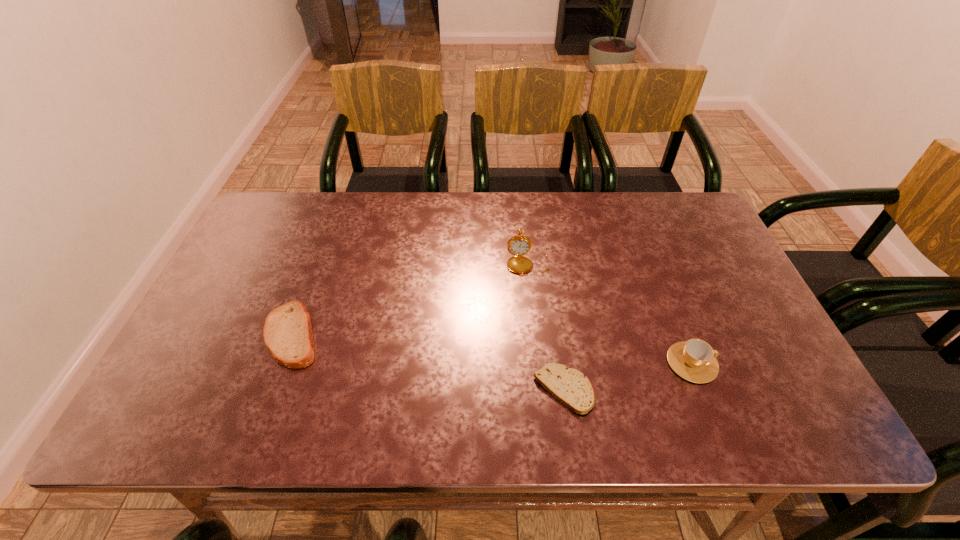
Identify the location of vacant space at the near right corner of the desktop. (795, 410).

At what (x,y) coordinates should I click in order to perform the action: click on free space between the leftmost object and the farthest object. Please return your answer as a coordinate pair (x, y). Looking at the image, I should click on (410, 299).

Where is `vacant area between the tallest object and the shorter pita bread`? The image size is (960, 540). vacant area between the tallest object and the shorter pita bread is located at coordinates (545, 326).

The width and height of the screenshot is (960, 540). In order to click on free space between the tallest object and the rightmost object in this screenshot , I will do `click(610, 313)`.

You are a GUI agent. You are given a task and a screenshot of the screen. Output one action in this format:
    pyautogui.click(x=<x>, y=<y>)
    Task: Click on the empty space that is in between the farthest object and the second tallest object
    
    Given the screenshot: What is the action you would take?
    (610, 313)

At what (x,y) coordinates should I click in order to perform the action: click on free point between the taller pita bread and the cup. Please return your answer as a coordinate pair (x, y). This screenshot has width=960, height=540. Looking at the image, I should click on (492, 349).

The image size is (960, 540). I want to click on unoccupied area between the shorter pita bread and the third shortest object, so click(628, 376).

You are a GUI agent. You are given a task and a screenshot of the screen. Output one action in this format:
    pyautogui.click(x=<x>, y=<y>)
    Task: Click on the unoccupied area between the left pita bread and the third shortest object
    
    Given the screenshot: What is the action you would take?
    pyautogui.click(x=492, y=349)

The image size is (960, 540). Identify the location of vacant area between the farthest object and the shorter pita bread. (545, 326).

You are a GUI agent. You are given a task and a screenshot of the screen. Output one action in this format:
    pyautogui.click(x=<x>, y=<y>)
    Task: Click on the free space between the shorter pita bread and the leftmost object
    
    Given the screenshot: What is the action you would take?
    pyautogui.click(x=428, y=362)